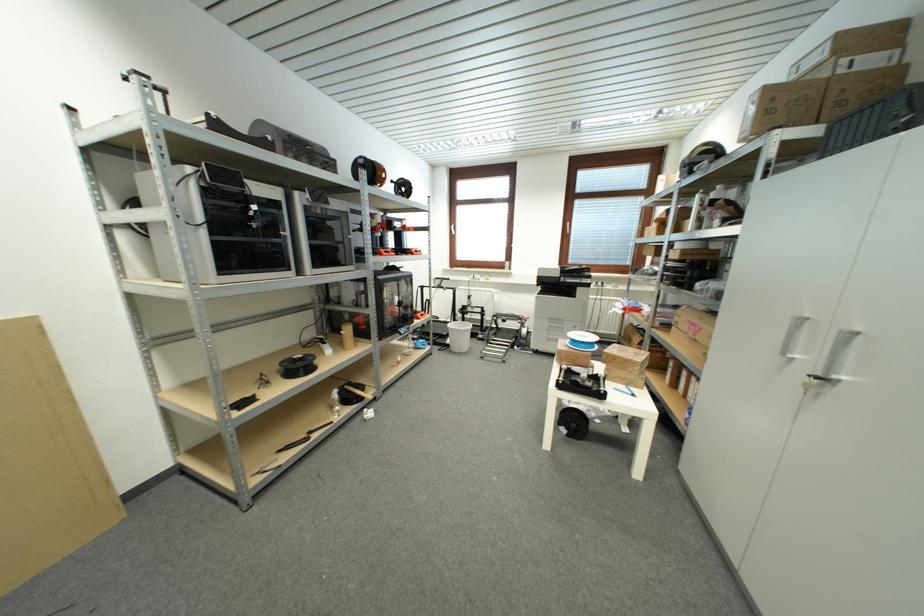
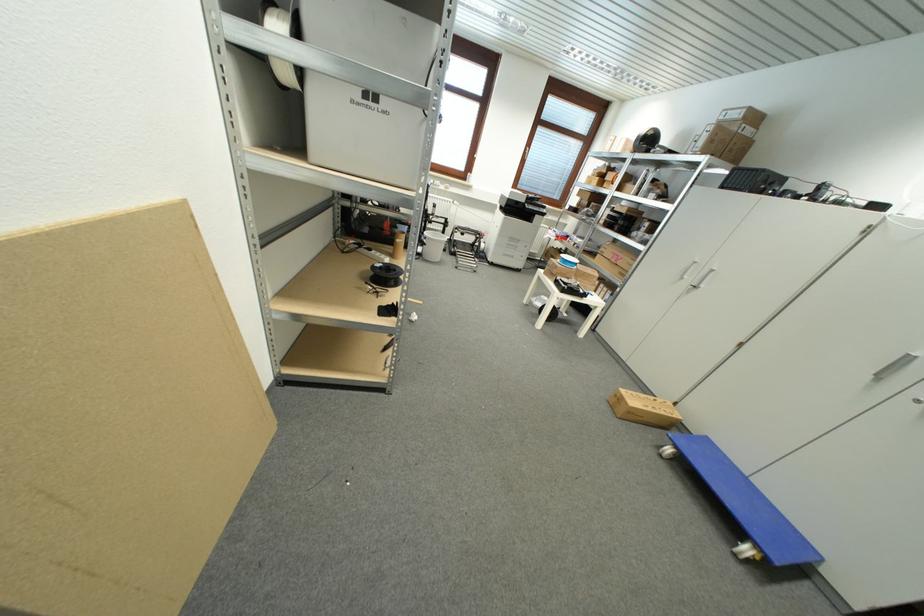
In the second image, find the point that corresponds to pixel 514 333 in the first image.

(468, 246)